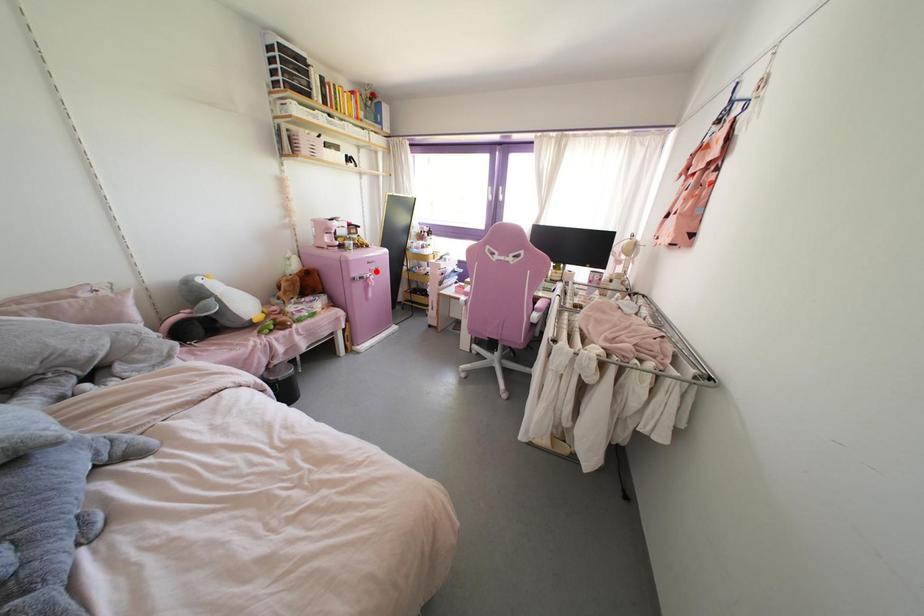
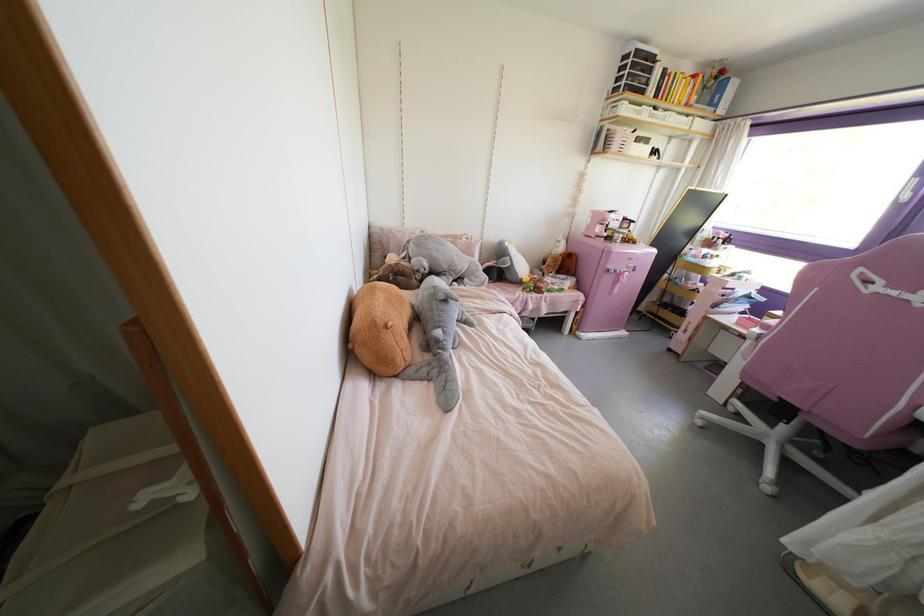
Question: I am providing you with two images of the same scene from different viewpoints. Given a red point in image1, look at the same physical point in image2. Is it:

Choices:
 (A) Closer to the viewpoint
 (B) Farther from the viewpoint

Answer: (B)